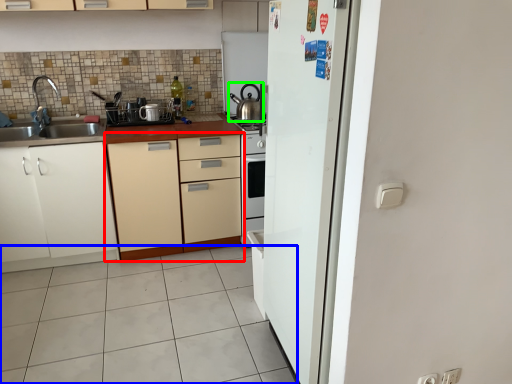
Question: Estimate the real-world distances between objects in this image. Which object is farther from cabinetry (highlighted by a red box), plain (highlighted by a blue box) or kitchen appliance (highlighted by a green box)?

Choices:
 (A) plain
 (B) kitchen appliance

Answer: (B)